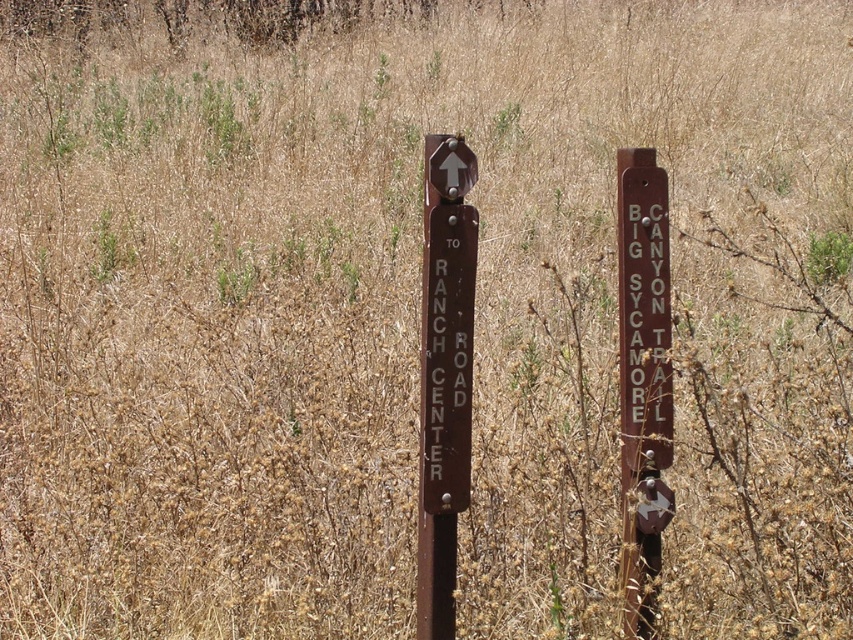
You are a hiker trying to decide which signpost to follow. Both the brown polished wood signpost at center and the brown metal signpost at right have arrows pointing upward. Which signpost is smaller in size?

The brown polished wood signpost at center occupies less space than the brown metal signpost at right, so it is smaller in size.

You are standing in a field and see the brown polished wood signpost at center and the brown metal signpost at right. Which signpost is closer to you?

The brown polished wood signpost at center is closer to you because it is in front of the brown metal signpost at right.